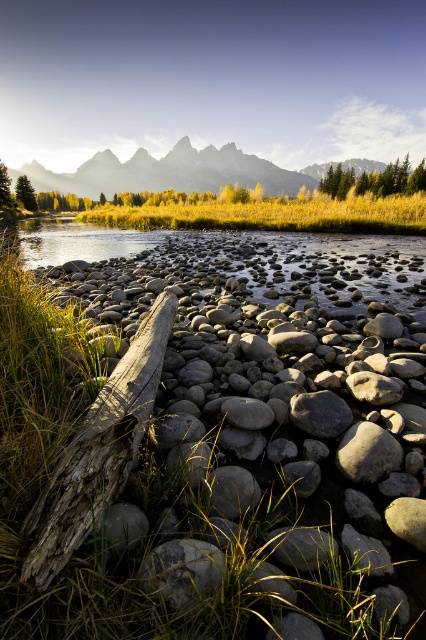
You are standing at the origin point of the coordinate system in the image. The image has a coordinate system where the bottom left corner is the origin point. You want to place a red flag at the location of the weathered wood log at center. What are the coordinates where you should place the flag?

The coordinates for placing the red flag at the weathered wood log at center are at point (97, 451).